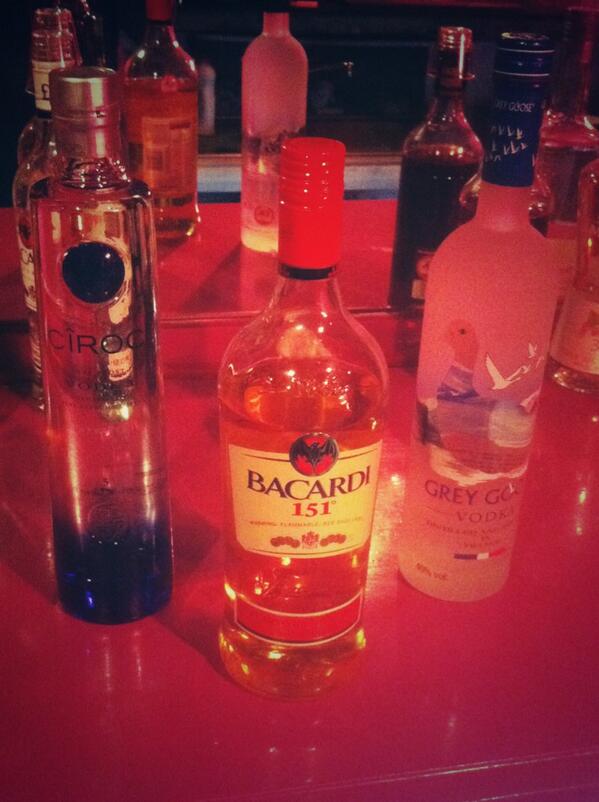
Locate an element on the screen. This screenshot has width=599, height=802. wall is located at coordinates (366, 91).